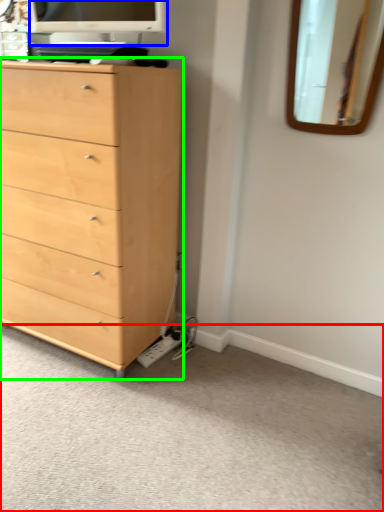
Question: Based on their relative distances, which object is nearer to plain (highlighted by a red box)? Choose from computer monitor (highlighted by a blue box) and chest of drawers (highlighted by a green box).

Choices:
 (A) computer monitor
 (B) chest of drawers

Answer: (B)